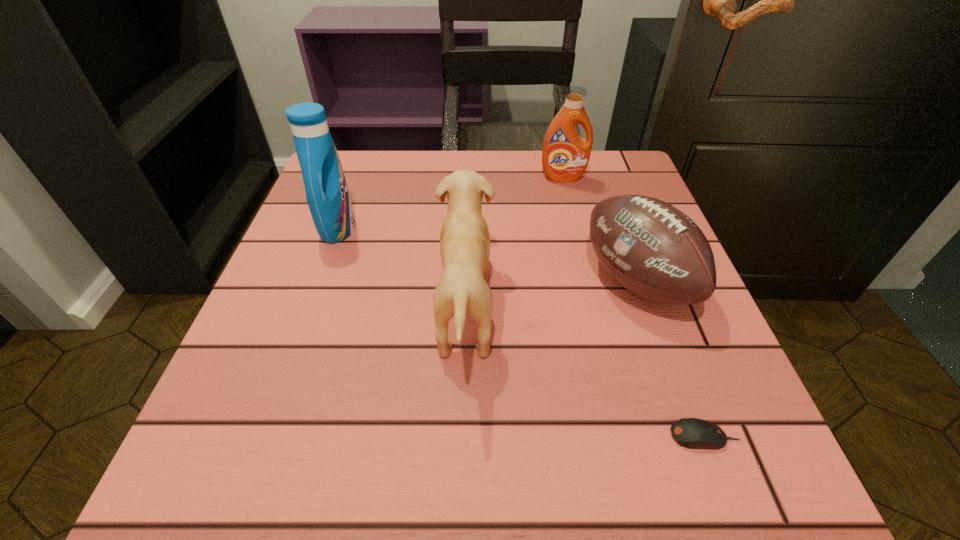
Identify the location of object present at the near right corner. This screenshot has height=540, width=960. (694, 433).

Locate an element on the screen. The width and height of the screenshot is (960, 540). free space at the far edge of the desktop is located at coordinates (451, 168).

In the image, there is a desktop. Where is `vacant space at the near edge`? vacant space at the near edge is located at coordinates (617, 446).

Where is `free point at the left edge`? free point at the left edge is located at coordinates (379, 219).

This screenshot has height=540, width=960. Identify the location of free space at the far left corner of the desktop. (389, 150).

Identify the location of vacant space at the near left corner. This screenshot has height=540, width=960. (180, 480).

In the image, there is a desktop. Find the location of `vacant space at the far right corner`. vacant space at the far right corner is located at coordinates (601, 164).

Where is `free space at the near right corner of the desktop`? The width and height of the screenshot is (960, 540). free space at the near right corner of the desktop is located at coordinates (767, 497).

This screenshot has width=960, height=540. I want to click on vacant area between the puppy and the fourth tallest object, so click(551, 295).

You are a GUI agent. You are given a task and a screenshot of the screen. Output one action in this format:
    pyautogui.click(x=<x>, y=<y>)
    Task: Click on the vacant area between the puppy and the farthest object
    The height and width of the screenshot is (540, 960).
    Given the screenshot: What is the action you would take?
    pyautogui.click(x=514, y=244)